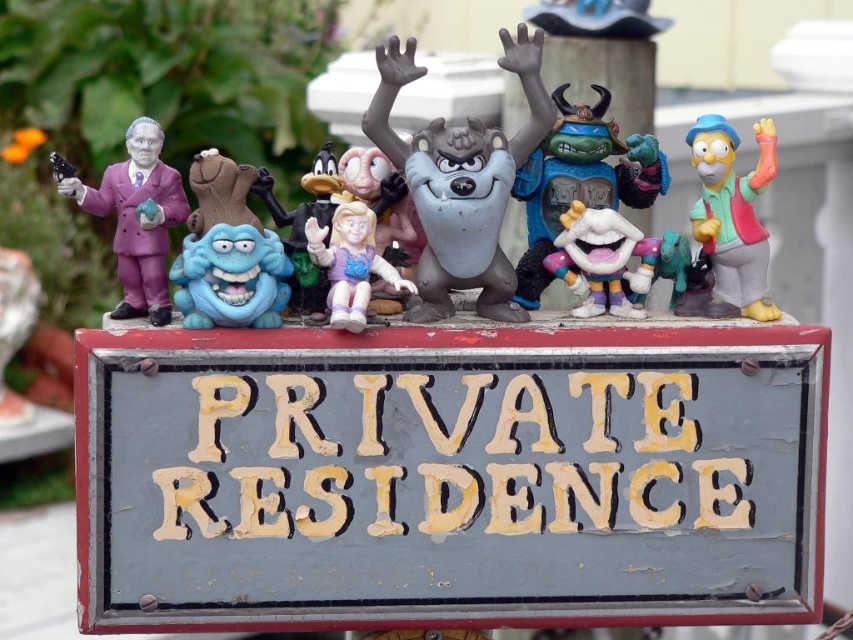
You are a delivery person approaching the house with the sign. You need to place a package on the sign without touching any of the figurines. The package is 1 foot wide. Can you fit it between the blue cartoonish creature and the matte gray wolf at center?

The matte gray wolf at center is 4.14 feet from the camera, so the distance between the blue cartoonish creature and the matte gray wolf at center is not specified. Therefore, it is uncertain if the package will fit.

You are a delivery person trying to place a package between the matte plastic figure at center and the white matte clown at center on the sign. Can you fit the package there?

The matte plastic figure at center is positioned over the white matte clown at center, so there is no space between them for the package.

You are a delivery person who needs to place a new 6 inch long package between the blue rubber monster at center and the white matte clown at center. Can you fit it there?

The blue rubber monster at center is 6.01 inches away from the white matte clown at center, so yes, the 6 inch long package can fit between them since the distance is slightly more than the package length.